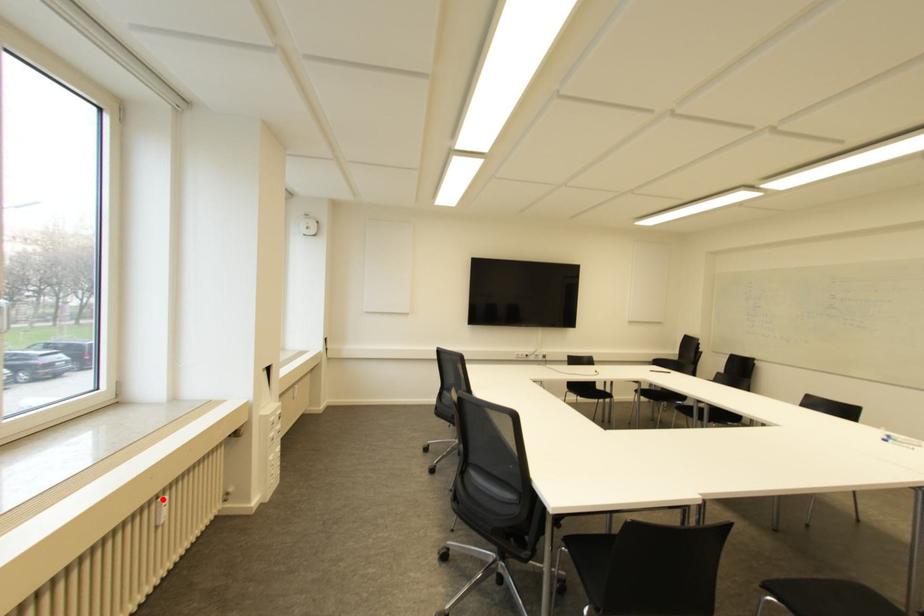
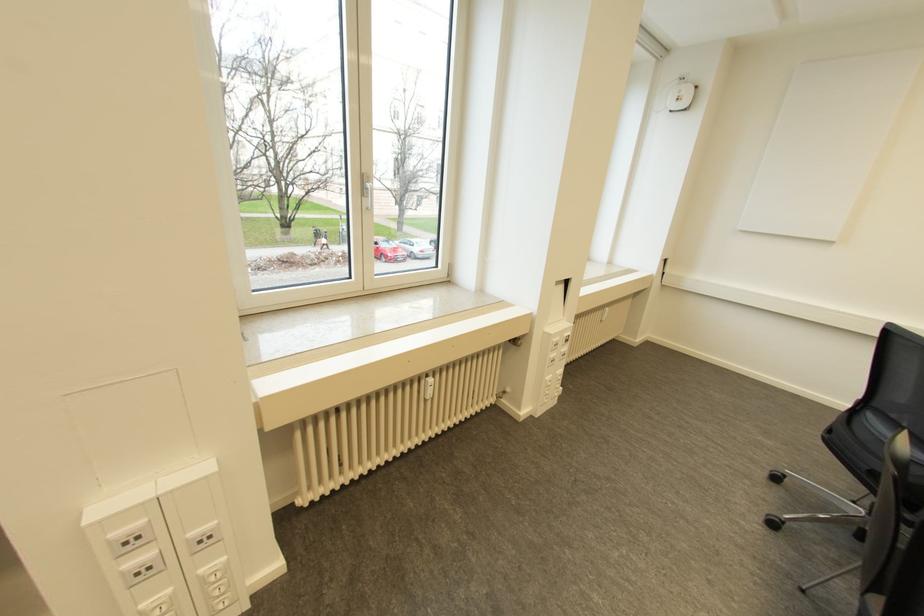
Question: I am providing you with two images of the same scene from different viewpoints. A red point is shown in image1. For the corresponding object point in image2, is it positioned nearer or farther from the camera?

Choices:
 (A) Nearer
 (B) Farther

Answer: (B)